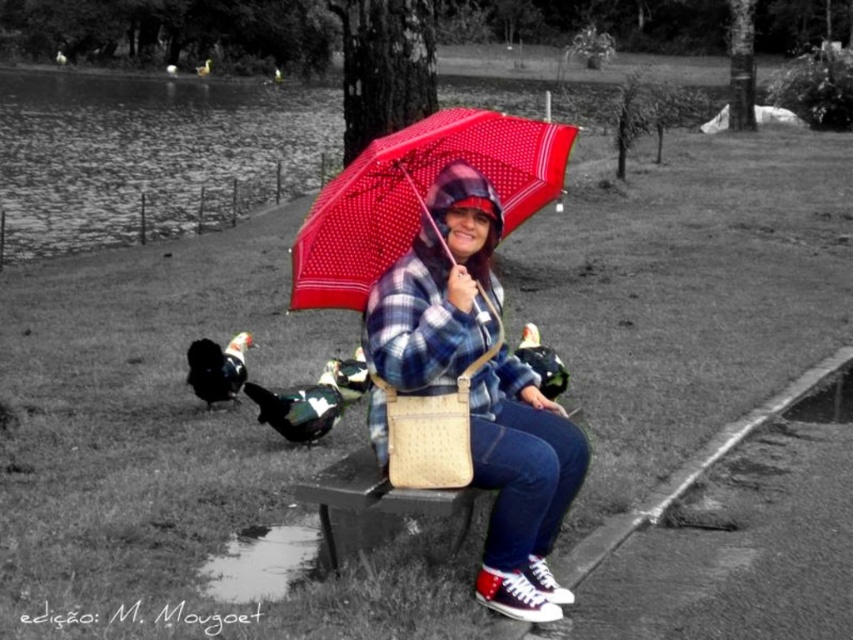
You are a photographer trying to capture the woman under the umbrella. Since the matte plaid jacket at center and the polka dot fabric umbrella at center are both in the frame, which one is closer to the camera?

The matte plaid jacket at center is positioned under the polka dot fabric umbrella at center, so the jacket is closer to the camera than the umbrella.

You are standing at the point labeled point (416,145) in the park scene. You want to walk to the point labeled point (492,525). Which direction should you move relative to your current position?

You should move forward because point (492,525) is behind point (416,145), meaning it is in the direction you are facing if you are at point (416,145).